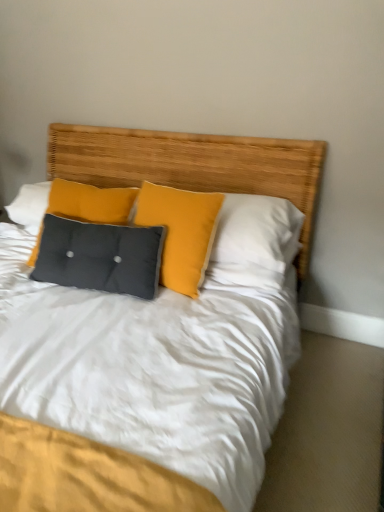
What do you see at coordinates (193, 165) in the screenshot? I see `woven wood headboard at center` at bounding box center [193, 165].

This screenshot has height=512, width=384. Identify the location of woven wood headboard at center. (193, 165).

The height and width of the screenshot is (512, 384). What are the coordinates of `woven wood headboard at center` in the screenshot? It's located at (193, 165).